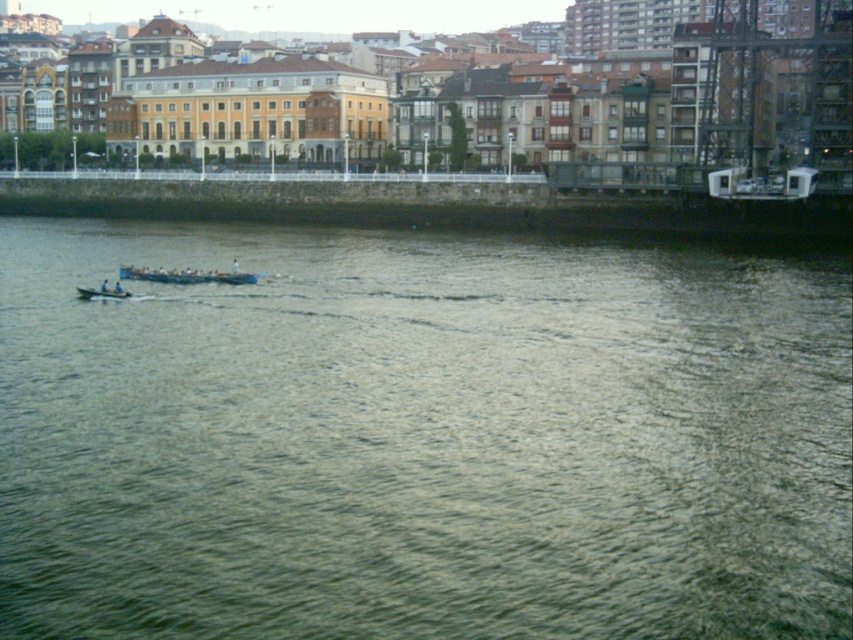
Question: Does blue glossy rowboat at center lie behind blue plastic boat at center?

Choices:
 (A) yes
 (B) no

Answer: (A)

Question: Based on their relative distances, which object is nearer to the green water at lower left?

Choices:
 (A) blue plastic boat at center
 (B) blue glossy rowboat at center

Answer: (B)

Question: Does green water at lower left have a greater width compared to blue plastic boat at center?

Choices:
 (A) no
 (B) yes

Answer: (B)

Question: Can you confirm if blue glossy rowboat at center is positioned to the left of blue plastic boat at center?

Choices:
 (A) no
 (B) yes

Answer: (A)

Question: Considering the real-world distances, which object is closest to the blue plastic boat at center?

Choices:
 (A) blue glossy rowboat at center
 (B) green water at lower left

Answer: (A)

Question: Which point is closer to the camera taking this photo?

Choices:
 (A) (241, 278)
 (B) (80, 298)

Answer: (B)